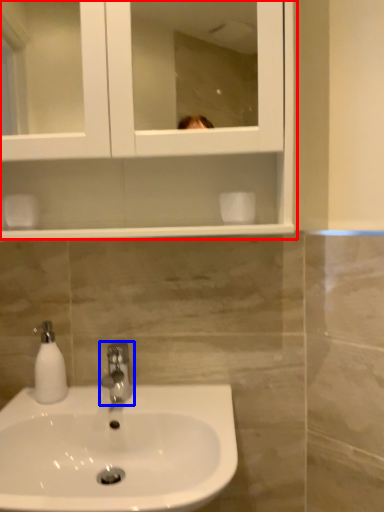
Question: Among these objects, which one is nearest to the camera, medicine cabinet (highlighted by a red box) or tap (highlighted by a blue box)?

Choices:
 (A) medicine cabinet
 (B) tap

Answer: (A)